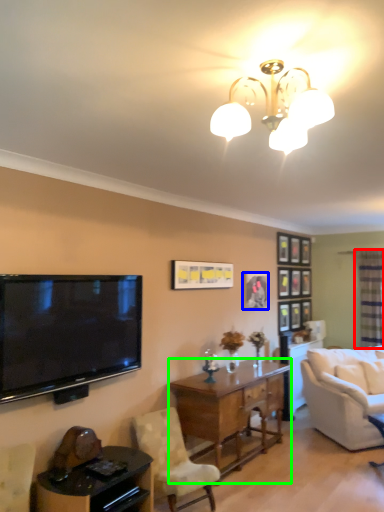
Question: Considering the real-world distances, which object is closest to glass door (highlighted by a red box)? picture frame (highlighted by a blue box) or desk (highlighted by a green box).

Choices:
 (A) picture frame
 (B) desk

Answer: (A)